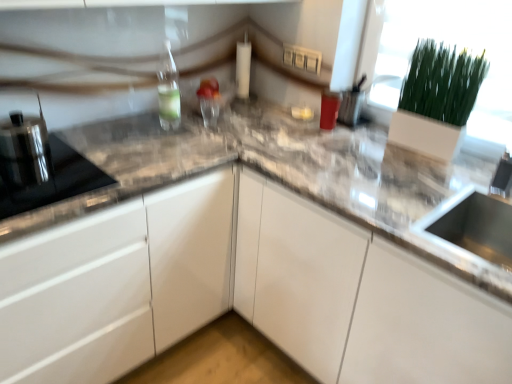
Find the location of a particular element. The height and width of the screenshot is (384, 512). vacant area that lies to the right of clear glass bottle at upper left is located at coordinates (207, 134).